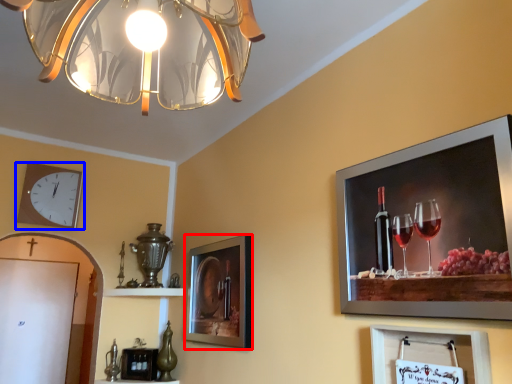
Question: Among these objects, which one is nearest to the camera, picture frame (highlighted by a red box) or wall clock (highlighted by a blue box)?

Choices:
 (A) picture frame
 (B) wall clock

Answer: (A)